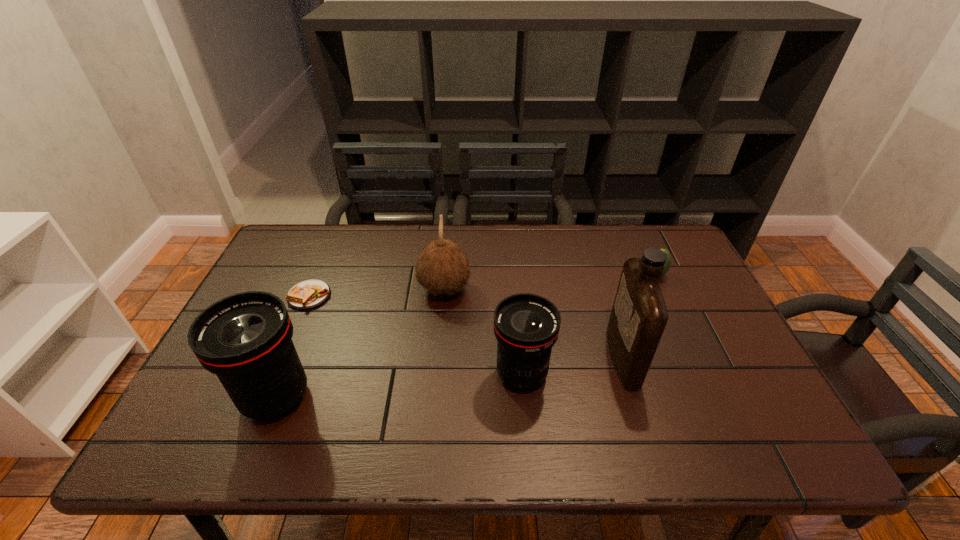
Locate an element on the screen. This screenshot has height=540, width=960. free space between the sandwich and the avocado is located at coordinates pyautogui.click(x=482, y=285).

Image resolution: width=960 pixels, height=540 pixels. I want to click on unoccupied area between the taller telephoto lens and the third object from right to left, so click(x=398, y=386).

The width and height of the screenshot is (960, 540). I want to click on free space between the sandwich and the fifth object from left to right, so click(466, 327).

The height and width of the screenshot is (540, 960). I want to click on unoccupied position between the coconut and the rightmost object, so click(550, 282).

Locate an element on the screen. The width and height of the screenshot is (960, 540). vacant point located between the taller telephoto lens and the fifth tallest object is located at coordinates (466, 336).

I want to click on free space between the fourth object from left to right and the rightmost object, so click(588, 325).

This screenshot has height=540, width=960. In order to click on vacant region between the sandwich and the fourth object from right to left in this screenshot , I will do `click(377, 293)`.

You are a GUI agent. You are given a task and a screenshot of the screen. Output one action in this format:
    pyautogui.click(x=<x>, y=<y>)
    Task: Click on the vacant area that lies between the left telephoto lens and the avocado
    The height and width of the screenshot is (540, 960).
    Given the screenshot: What is the action you would take?
    pyautogui.click(x=466, y=336)

Image resolution: width=960 pixels, height=540 pixels. Find the location of `object that is the closest to the shortest object`. object that is the closest to the shortest object is located at coordinates (245, 339).

Locate an element on the screen. the fourth closest object to the taller telephoto lens is located at coordinates (639, 315).